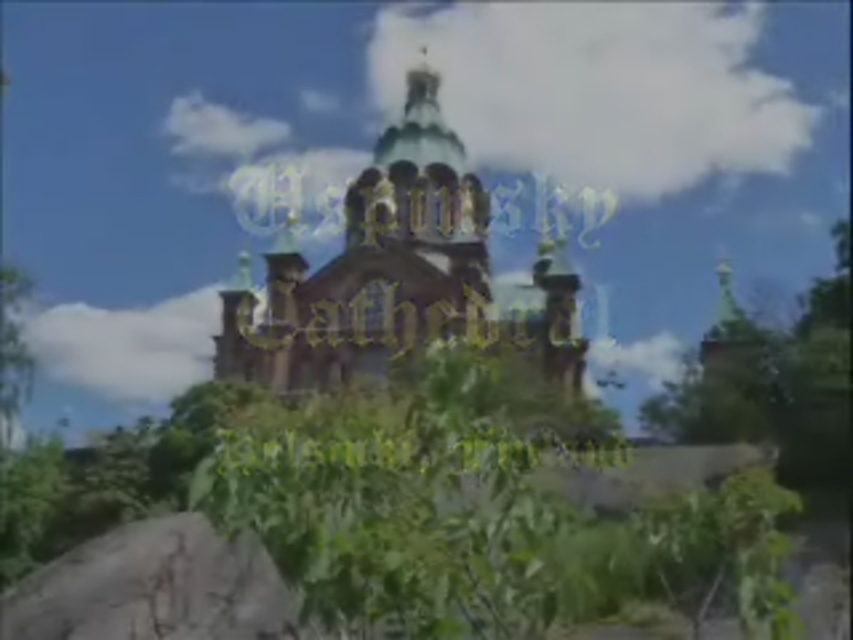
You are standing at the base of the cathedral hill and looking towards the cathedral. There are two points marked on the image, point 1 at coordinates point (476, 344) and point 2 at coordinates point (291, 611). Which point is closer to you?

Point (476, 344) is closer to you because it is further to the viewer than point (291, 611).

You are standing in a field looking at the golden stone cathedral at center and the gray rough stone at lower left. Which object is closer to you?

The golden stone cathedral at center is closer to you than the gray rough stone at lower left because it is further to the viewer.